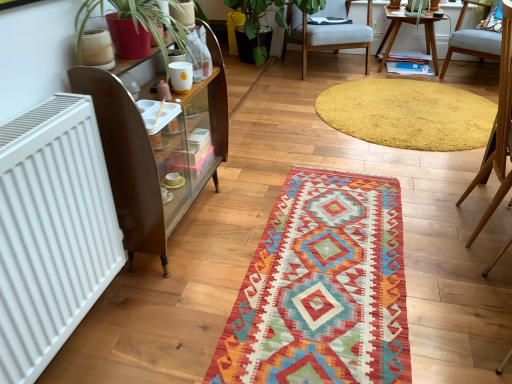
Locate an element on the screen. Image resolution: width=512 pixels, height=384 pixels. vacant space behind multicolored woven mat at center, the first mat when ordered from front to back is located at coordinates (304, 156).